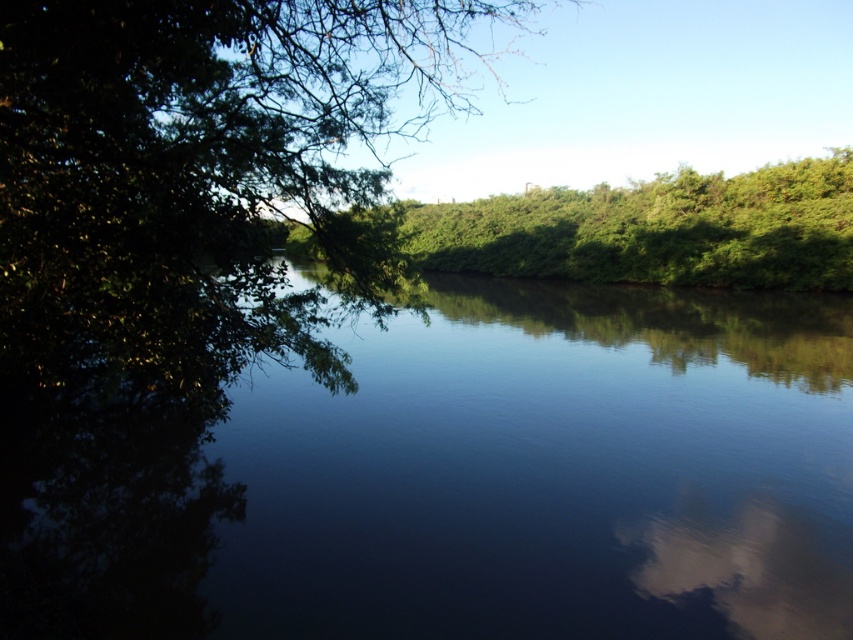
Which is more to the right, green leafy tree at left or green leafy trees at center?

Positioned to the right is green leafy trees at center.

Can you confirm if green leafy tree at left is shorter than green leafy trees at center?

No.

You are a GUI agent. You are given a task and a screenshot of the screen. Output one action in this format:
    pyautogui.click(x=<x>, y=<y>)
    Task: Click on the green leafy tree at left
    The height and width of the screenshot is (640, 853).
    Given the screenshot: What is the action you would take?
    pyautogui.click(x=192, y=163)

Who is shorter, dark reflective water at center or green leafy trees at center?

dark reflective water at center is shorter.

The height and width of the screenshot is (640, 853). What do you see at coordinates (450, 472) in the screenshot?
I see `dark reflective water at center` at bounding box center [450, 472].

Identify the location of dark reflective water at center. (450, 472).

This screenshot has height=640, width=853. Describe the element at coordinates (450, 472) in the screenshot. I see `dark reflective water at center` at that location.

Which is in front, point (561, 316) or point (352, 129)?

Positioned in front is point (352, 129).

Identify the location of dark reflective water at center. (450, 472).